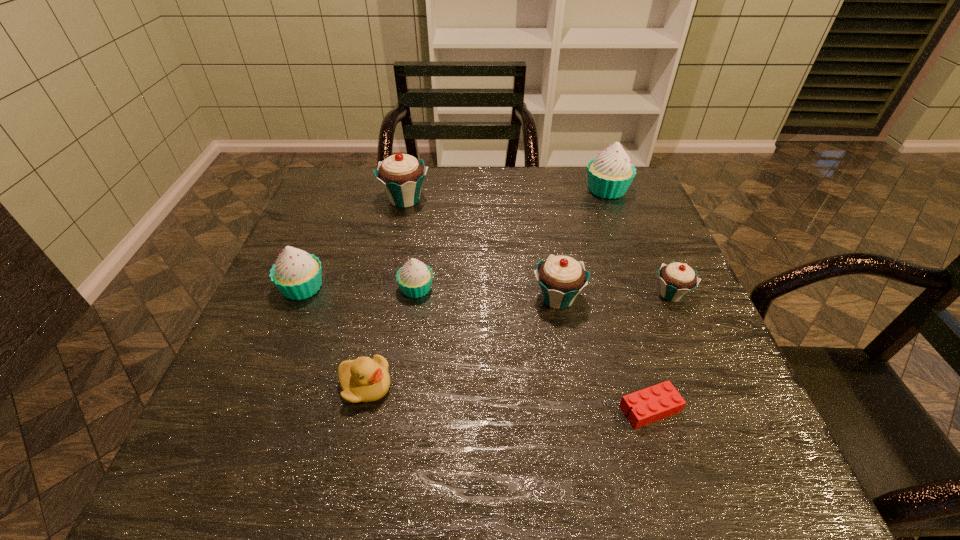
Locate an element on the screen. Image resolution: width=960 pixels, height=540 pixels. blank space located on the back of the shortest object is located at coordinates (622, 316).

The image size is (960, 540). In order to click on object that is at the left edge in this screenshot , I will do `click(297, 274)`.

Locate an element on the screen. The width and height of the screenshot is (960, 540). Lego that is at the right edge is located at coordinates (657, 402).

I want to click on object that is at the far right corner, so click(x=610, y=174).

In the image, there is a desktop. Identify the location of vacant space at the far edge. (388, 202).

In the image, there is a desktop. Where is `vacant space at the near edge`? vacant space at the near edge is located at coordinates (671, 487).

Find the location of a particular element. The image size is (960, 540). vacant region at the left edge is located at coordinates (228, 377).

This screenshot has width=960, height=540. What are the coordinates of `vacant area at the far left corner of the desktop` in the screenshot? It's located at (330, 175).

Locate an element on the screen. The image size is (960, 540). free space at the far right corner is located at coordinates (636, 197).

At what (x,y) coordinates should I click in order to perform the action: click on free spot at the near right corner of the desktop. Please return your answer as a coordinate pair (x, y). Looking at the image, I should click on (681, 442).